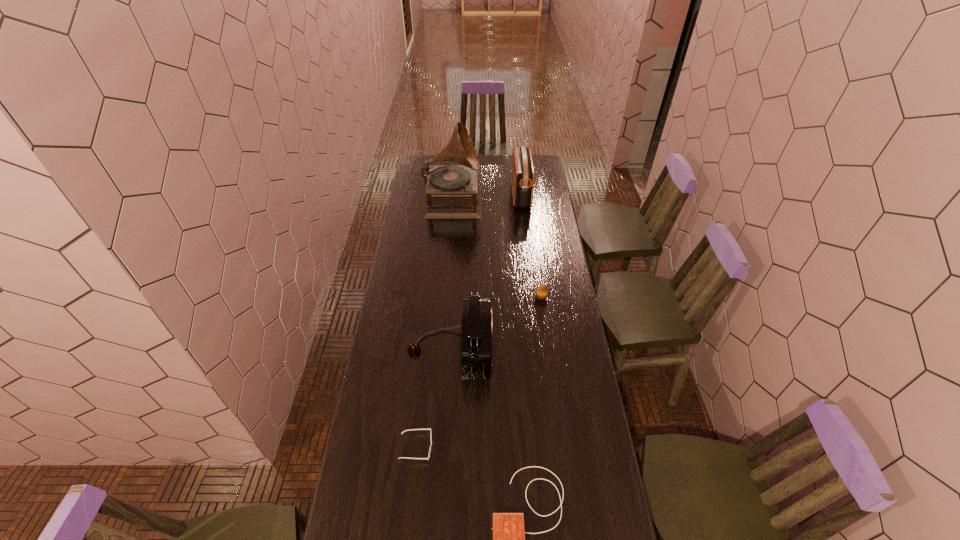
At what (x,y) coordinates should I click in order to perform the action: click on radio receiver object that ranks as the closest to the second nearest radio receiver. Please return your answer as a coordinate pair (x, y). Looking at the image, I should click on (508, 535).

Where is `radio receiver that stands as the closest to the farthest radio receiver`? This screenshot has height=540, width=960. radio receiver that stands as the closest to the farthest radio receiver is located at coordinates (x=476, y=325).

I want to click on free spot that satisfies the following two spatial constraints: 1. on the front side of the third farthest object; 2. with the lenses of the sunglasses facing outward, so click(561, 447).

Identify the location of vacant space that satisfies the following two spatial constraints: 1. on the front side of the fourth nearest object; 2. on the front-facing side of the third nearest object. 548,349.